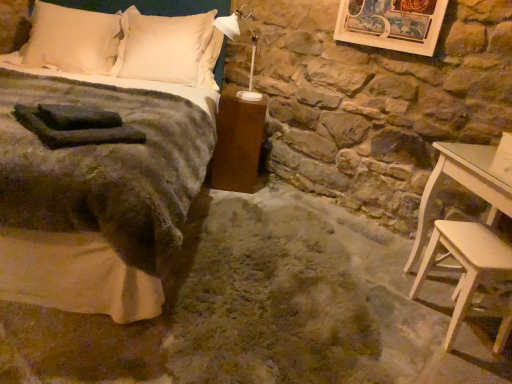
I want to click on vacant location below light beige wood stool at lower right (from a real-world perspective), so click(443, 325).